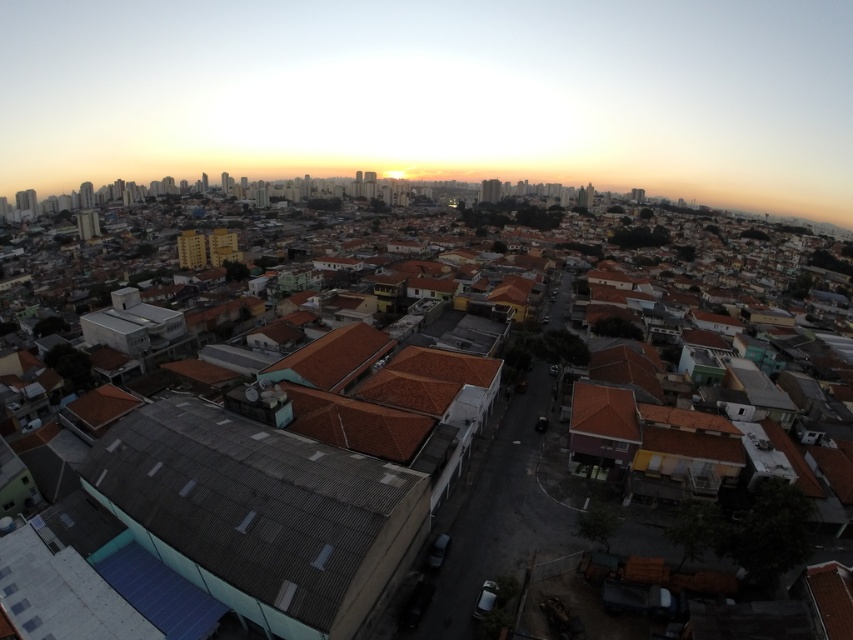
Question: Does brown tile roof at center appear over gray corrugated metal roof at lower left?

Choices:
 (A) yes
 (B) no

Answer: (A)

Question: Is brown tile roof at center wider than gray corrugated metal roof at lower left?

Choices:
 (A) yes
 (B) no

Answer: (A)

Question: Which of the following is the farthest from the observer?

Choices:
 (A) brown tile roof at center
 (B) gray corrugated metal roof at lower left

Answer: (A)

Question: From the image, what is the correct spatial relationship of brown tile roof at center in relation to gray corrugated metal roof at lower left?

Choices:
 (A) left
 (B) right

Answer: (B)